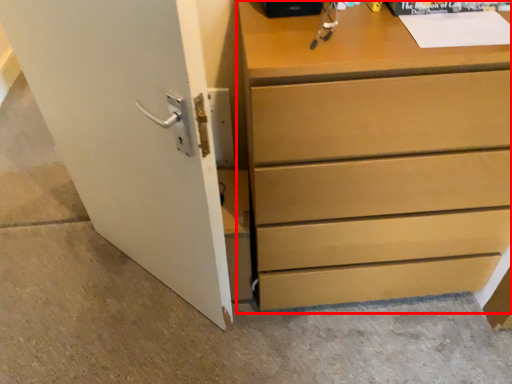
Question: From the image's perspective, what is the correct spatial relationship of chest of drawers (annotated by the red box) in relation to door?

Choices:
 (A) above
 (B) below

Answer: (A)